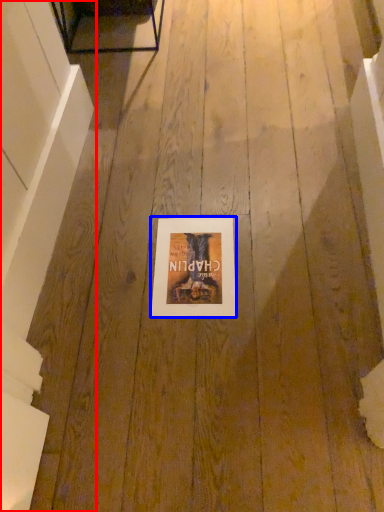
Question: Which object appears farthest to the camera in this image, stairwell (highlighted by a red box) or picture frame (highlighted by a blue box)?

Choices:
 (A) stairwell
 (B) picture frame

Answer: (B)